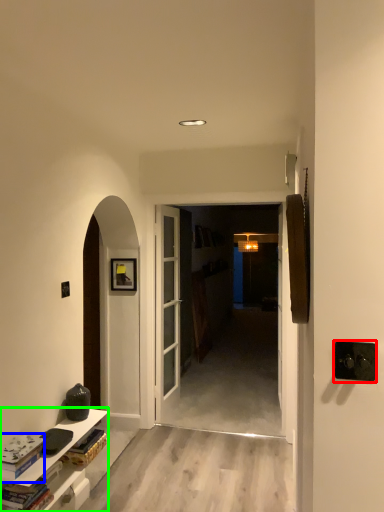
Question: Based on their relative distances, which object is nearer to door handle (highlighted by a red box)? Choose from book (highlighted by a blue box) and cabinetry (highlighted by a green box).

Choices:
 (A) book
 (B) cabinetry

Answer: (A)